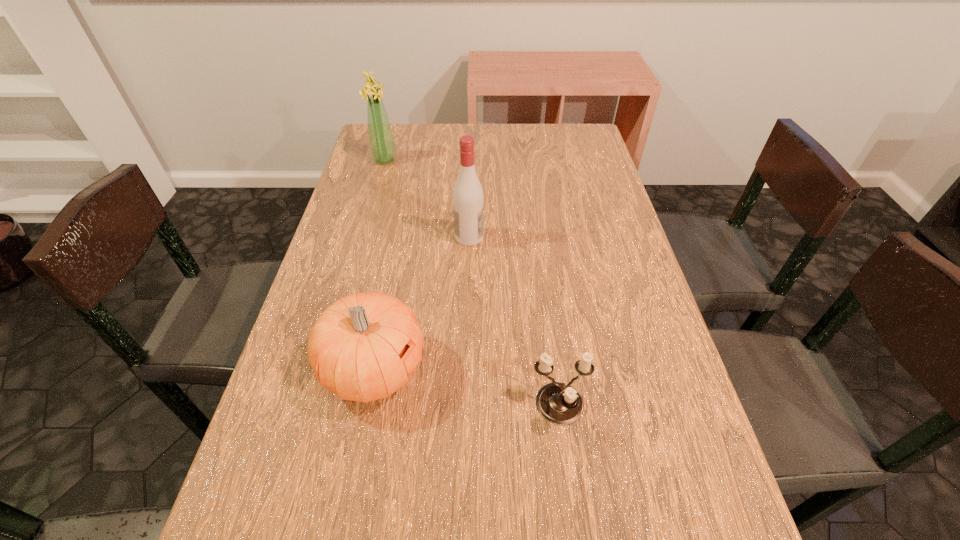
Find the location of `object present at the far edge`. object present at the far edge is located at coordinates (382, 146).

I want to click on bouquet that is at the left edge, so click(382, 146).

Locate an element on the screen. pumpkin at the left edge is located at coordinates (363, 347).

Find the location of a particular element. object that is at the far left corner is located at coordinates (382, 146).

Locate an element on the screen. This screenshot has height=540, width=960. vacant space at the far edge is located at coordinates (531, 138).

In the image, there is a desktop. Identify the location of blank space at the left edge. (327, 425).

Image resolution: width=960 pixels, height=540 pixels. In the image, there is a desktop. In order to click on vacant space at the right edge in this screenshot , I will do `click(602, 198)`.

The width and height of the screenshot is (960, 540). In order to click on vacant space that is in between the shortest object and the pumpkin in this screenshot , I will do `click(467, 388)`.

Find the location of a particular element. free space between the rightmost object and the second farthest object is located at coordinates (515, 322).

Find the location of `vacant area that lies between the second object from right to left and the bouquet`. vacant area that lies between the second object from right to left and the bouquet is located at coordinates (427, 199).